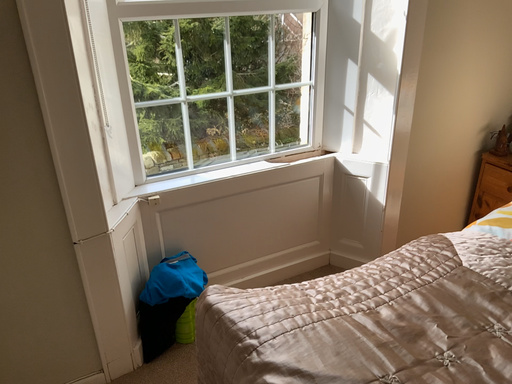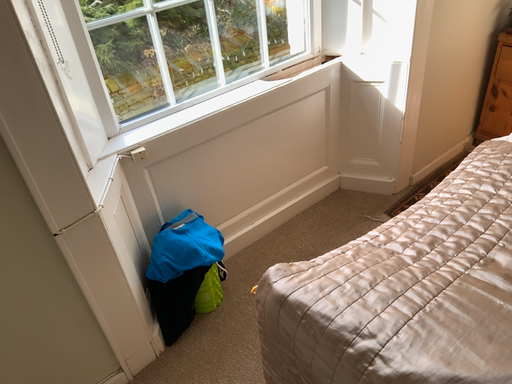
Question: How did the camera likely rotate when shooting the video?

Choices:
 (A) rotated downward
 (B) rotated upward

Answer: (A)